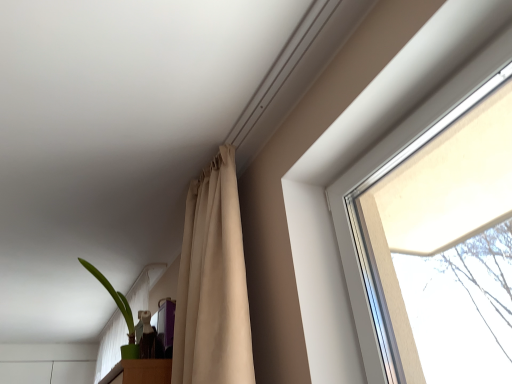
Question: From a real-world perspective, is beige fabric curtain at upper center physically below green matte plant pot at lower left?

Choices:
 (A) yes
 (B) no

Answer: (A)

Question: Is beige fabric curtain at upper center to the right of green matte plant pot at lower left from the viewer's perspective?

Choices:
 (A) yes
 (B) no

Answer: (A)

Question: Can you confirm if beige fabric curtain at upper center is smaller than green matte plant pot at lower left?

Choices:
 (A) yes
 (B) no

Answer: (B)

Question: Is beige fabric curtain at upper center not close to green matte plant pot at lower left?

Choices:
 (A) no
 (B) yes

Answer: (B)

Question: From the image's perspective, is beige fabric curtain at upper center on top of green matte plant pot at lower left?

Choices:
 (A) yes
 (B) no

Answer: (A)

Question: Is beige fabric curtain at upper center closer to the viewer compared to green matte plant pot at lower left?

Choices:
 (A) no
 (B) yes

Answer: (B)

Question: Does green matte plant pot at lower left have a larger size compared to beige fabric curtain at upper center?

Choices:
 (A) no
 (B) yes

Answer: (A)

Question: Is green matte plant pot at lower left behind beige fabric curtain at upper center?

Choices:
 (A) yes
 (B) no

Answer: (A)

Question: From the image's perspective, is green matte plant pot at lower left beneath beige fabric curtain at upper center?

Choices:
 (A) yes
 (B) no

Answer: (A)

Question: Is green matte plant pot at lower left positioned in front of beige fabric curtain at upper center?

Choices:
 (A) no
 (B) yes

Answer: (A)

Question: Can you confirm if green matte plant pot at lower left is shorter than beige fabric curtain at upper center?

Choices:
 (A) no
 (B) yes

Answer: (B)

Question: Does green matte plant pot at lower left have a greater height compared to beige fabric curtain at upper center?

Choices:
 (A) yes
 (B) no

Answer: (B)

Question: From the image's perspective, relative to beige fabric curtain at upper center, is green matte plant pot at lower left above or below?

Choices:
 (A) below
 (B) above

Answer: (A)